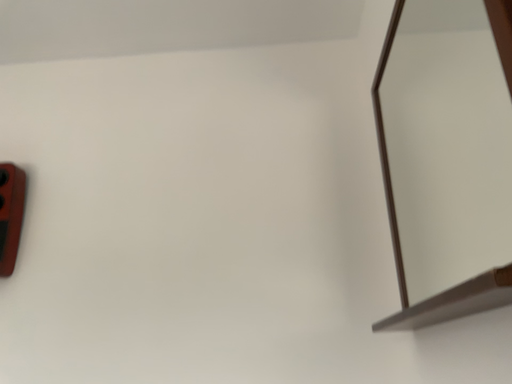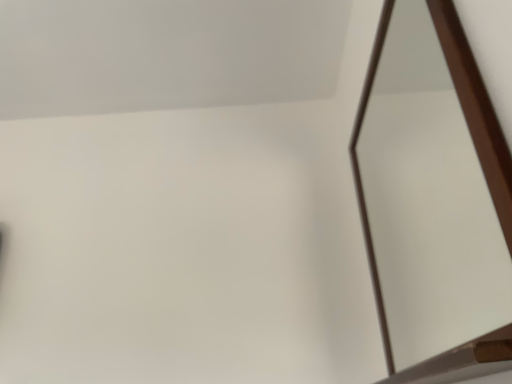
Question: Which way did the camera rotate in the video?

Choices:
 (A) rotated upward
 (B) rotated downward

Answer: (A)